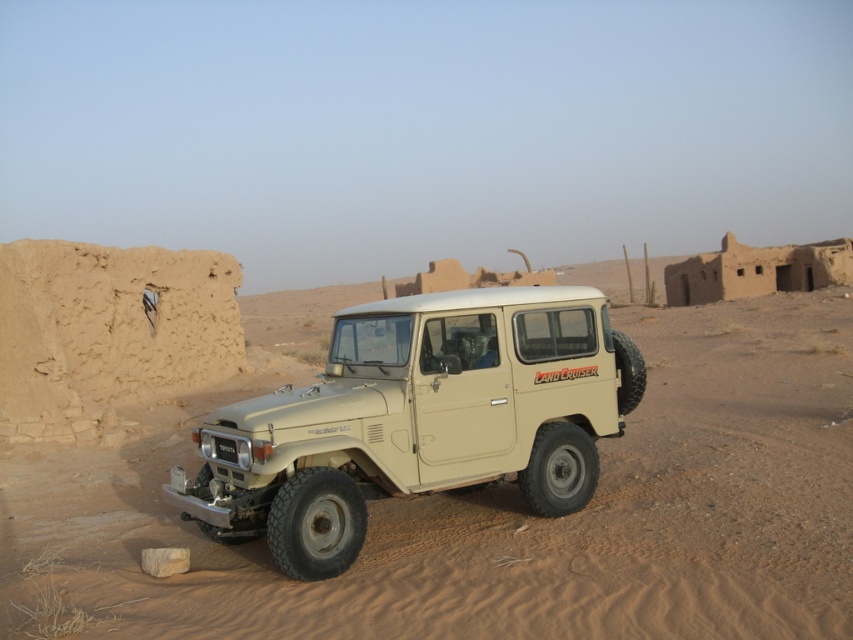
Is point (646, 316) closer to viewer compared to point (352, 524)?

No, it is not.

Is beige sand at center to the right of beige matte landcruiser at center from the viewer's perspective?

Yes, beige sand at center is to the right of beige matte landcruiser at center.

Is point (601, 285) positioned behind point (582, 468)?

Yes, it is.

Identify the location of beige sand at center. click(490, 506).